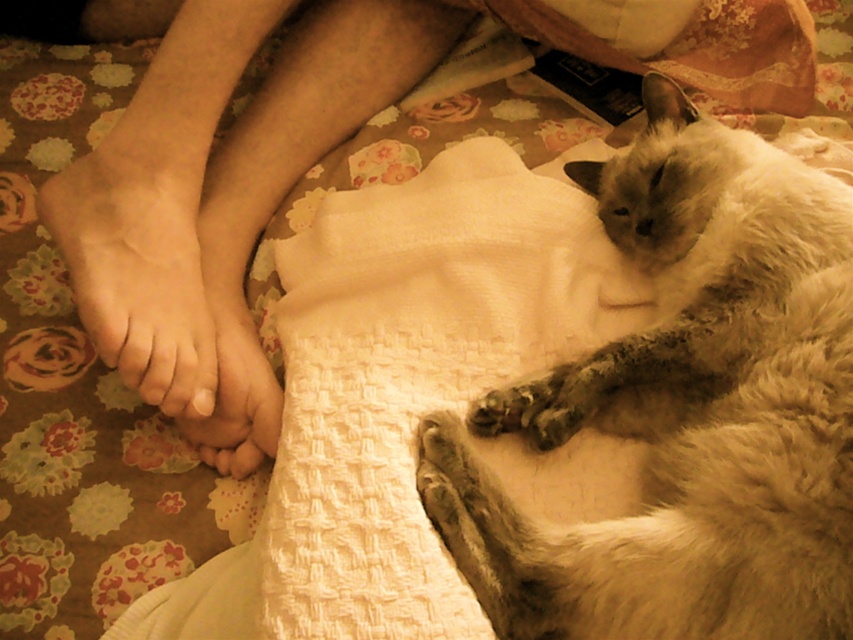
You are a photographer trying to capture a closeup of the silky white cat at upper right without the smooth skin foot at center appearing in the frame. Based on their positions, is this possible?

Yes, the silky white cat at upper right is in front of the smooth skin foot at center, so you can position the camera to focus on the cat while the foot is blocked from view.

You are holding a 12 inch ruler and want to measure the distance between the camera and point (148, 355). Can you determine if the distance is more than a ruler length?

The distance between the camera and point (148, 355) is 37.48 inches, which is longer than the 12 inch ruler. Therefore, the distance is more than a ruler length.